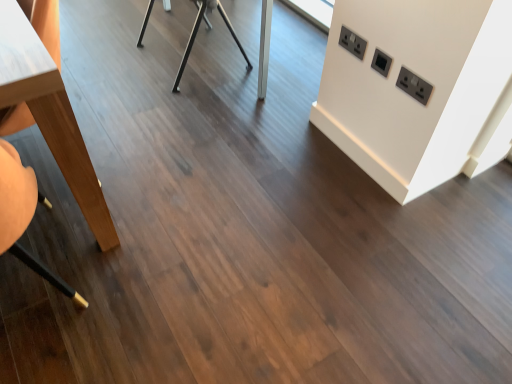
Identify the location of free point to the left of metallic silver table at center, the 2th table positioned from the front. (114, 49).